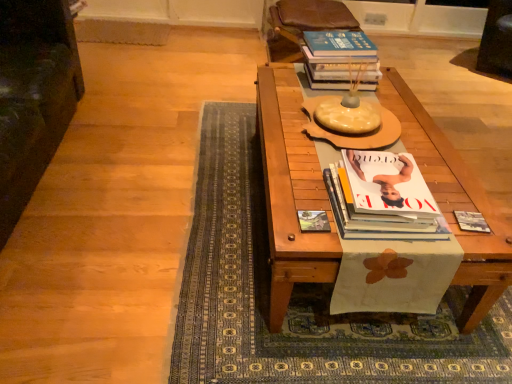
Measure the distance between matte black book at right, which is the 1th book in bottom-to-top order, and camera.

1.23 meters.

At what (x,y) coordinates should I click in order to perform the action: click on blue hardcover book at upper right, which is the third book from front to back. Please return your answer as a coordinate pair (x, y). This screenshot has width=512, height=384. Looking at the image, I should click on (340, 60).

What do you see at coordinates (340, 60) in the screenshot?
I see `blue hardcover book at upper right, placed as the 1th book when sorted from back to front` at bounding box center [340, 60].

The width and height of the screenshot is (512, 384). Identify the location of matte paper book cover at center. (313, 221).

What do you see at coordinates (313, 221) in the screenshot? The height and width of the screenshot is (384, 512). I see `matte paper book cover at center` at bounding box center [313, 221].

At what (x,y) coordinates should I click in order to perform the action: click on dark green fabric armchair at left, the 1th armchair in the left-to-right sequence. Please return your answer as a coordinate pair (x, y). The width and height of the screenshot is (512, 384). Looking at the image, I should click on (33, 96).

Find the location of a particular element. The height and width of the screenshot is (384, 512). book cover above the matte black book at right, the 2th book when ordered from back to front (from a real-world perspective) is located at coordinates (313, 221).

Is matte paper book cover at center to the left of matte black book at right, marked as the third book in a top-to-bottom arrangement, from the viewer's perspective?

Correct, you'll find matte paper book cover at center to the left of matte black book at right, marked as the third book in a top-to-bottom arrangement.

Can we say matte paper book cover at center lies outside matte black book at right, the 2th book when ordered from back to front?

That's correct, matte paper book cover at center is outside of matte black book at right, the 2th book when ordered from back to front.

Is matte paper book cover at center looking in the opposite direction of matte black book at right, the 2th book when ordered from back to front?

Correct, matte paper book cover at center is looking away from matte black book at right, the 2th book when ordered from back to front.

From a real-world perspective, does matte black book at right, which is the 2th book in front-to-back order, sit lower than brown leather armchair at upper center, the 2th armchair when ordered from left to right?

Actually, matte black book at right, which is the 2th book in front-to-back order, is physically above brown leather armchair at upper center, the 2th armchair when ordered from left to right, in the real world.

Considering the points (466, 227) and (264, 2), which point is in front, point (466, 227) or point (264, 2)?

The point (466, 227) is in front.

Considering the sizes of objects matte black book at right, which is the 2th book in front-to-back order, and brown leather armchair at upper center, which is the first armchair in back-to-front order, in the image provided, who is thinner, matte black book at right, which is the 2th book in front-to-back order, or brown leather armchair at upper center, which is the first armchair in back-to-front order,?

matte black book at right, which is the 2th book in front-to-back order.

From the image's perspective, is wooden table at center above or below brown leather armchair at upper center, the 2th armchair when ordered from left to right?

From the image's perspective, wooden table at center appears below brown leather armchair at upper center, the 2th armchair when ordered from left to right.

From the image's perspective, starting from the wooden table at center, which armchair is the 2nd one above? Please provide its 2D coordinates.

[(301, 25)]

Is wooden table at center far from brown leather armchair at upper center, the 2th armchair when ordered from left to right?

Indeed, wooden table at center is not near brown leather armchair at upper center, the 2th armchair when ordered from left to right.

Is wooden table at center inside or outside of brown leather armchair at upper center, which is counted as the 2th armchair, starting from the front?

wooden table at center cannot be found inside brown leather armchair at upper center, which is counted as the 2th armchair, starting from the front.

Is brown leather armchair at upper center, which is the first armchair in right-to-left order, bigger than white glossy magazine at center, acting as the 2th book starting from the top?

Yes, brown leather armchair at upper center, which is the first armchair in right-to-left order, is bigger than white glossy magazine at center, acting as the 2th book starting from the top.

Is brown leather armchair at upper center, which is the first armchair in right-to-left order, next to white glossy magazine at center, the third book from the back, and touching it?

There is a gap between brown leather armchair at upper center, which is the first armchair in right-to-left order, and white glossy magazine at center, the third book from the back.

From the image's perspective, which one is positioned lower, brown leather armchair at upper center, the 2th armchair when ordered from left to right, or white glossy magazine at center, acting as the 2th book starting from the top?

white glossy magazine at center, acting as the 2th book starting from the top, from the image's perspective.

From the brown leather armchair at upper center, which is counted as the 2th armchair, starting from the front, count the 1st book to the left and point to it. Please provide its 2D coordinates.

[(381, 198)]

Is blue hardcover book at upper right, the 1th book in the top-to-bottom sequence, located within matte black book at right, which is the 1th book in bottom-to-top order?

No, blue hardcover book at upper right, the 1th book in the top-to-bottom sequence, is located outside of matte black book at right, which is the 1th book in bottom-to-top order.

Between matte black book at right, the 2th book when ordered from back to front, and blue hardcover book at upper right, which is the third book from front to back, which one has more height?

blue hardcover book at upper right, which is the third book from front to back.

In the scene shown: In the image, is matte black book at right, which is the 2th book in front-to-back order, on the left side or the right side of blue hardcover book at upper right, placed as the 1th book when sorted from back to front?

Clearly, matte black book at right, which is the 2th book in front-to-back order, is on the right of blue hardcover book at upper right, placed as the 1th book when sorted from back to front, in the image.

From the picture: Does matte black book at right, which is the 2th book in front-to-back order, touch blue hardcover book at upper right, the 1th book in the top-to-bottom sequence?

No.

Considering the relative positions of wooden table at center and white glossy magazine at center, the first book in the front-to-back sequence, in the image provided, is wooden table at center to the right of white glossy magazine at center, the first book in the front-to-back sequence, from the viewer's perspective?

In fact, wooden table at center is to the left of white glossy magazine at center, the first book in the front-to-back sequence.

Measure the distance from wooden table at center to white glossy magazine at center, which is counted as the 2th book, starting from the bottom.

wooden table at center and white glossy magazine at center, which is counted as the 2th book, starting from the bottom, are 8.78 inches apart from each other.

Is wooden table at center inside the boundaries of white glossy magazine at center, which is counted as the 2th book, starting from the bottom, or outside?

wooden table at center exists outside the volume of white glossy magazine at center, which is counted as the 2th book, starting from the bottom.

Considering their positions, is wooden table at center located in front of or behind white glossy magazine at center, acting as the 2th book starting from the top?

Clearly, wooden table at center is in front of white glossy magazine at center, acting as the 2th book starting from the top.

From the picture: From a real-world perspective, is dark green fabric armchair at left, marked as the second armchair in a back-to-front arrangement, under blue hardcover book at upper right, placed as the 1th book when sorted from back to front?

Yes, from a real-world perspective, dark green fabric armchair at left, marked as the second armchair in a back-to-front arrangement, is beneath blue hardcover book at upper right, placed as the 1th book when sorted from back to front.

Considering the relative positions of dark green fabric armchair at left, the second armchair when ordered from right to left, and blue hardcover book at upper right, the 1th book in the top-to-bottom sequence, in the image provided, is dark green fabric armchair at left, the second armchair when ordered from right to left, to the right of blue hardcover book at upper right, the 1th book in the top-to-bottom sequence, from the viewer's perspective?

No, dark green fabric armchair at left, the second armchair when ordered from right to left, is not to the right of blue hardcover book at upper right, the 1th book in the top-to-bottom sequence.

Are dark green fabric armchair at left, the 1th armchair in the left-to-right sequence, and blue hardcover book at upper right, the third book ordered from the bottom, making contact?

There is a gap between dark green fabric armchair at left, the 1th armchair in the left-to-right sequence, and blue hardcover book at upper right, the third book ordered from the bottom.

Where is `book cover located above the matte black book at right, marked as the third book in a top-to-bottom arrangement (from the image's perspective)`? Image resolution: width=512 pixels, height=384 pixels. book cover located above the matte black book at right, marked as the third book in a top-to-bottom arrangement (from the image's perspective) is located at coordinates (313, 221).

This screenshot has width=512, height=384. What are the coordinates of `armchair that is behind the matte black book at right, marked as the third book in a top-to-bottom arrangement` in the screenshot? It's located at (301, 25).

Consider the image. Which object lies further to the anchor point matte black book at right, the 2th book when ordered from back to front, matte paper book cover at center or dark green fabric armchair at left, the second armchair when ordered from right to left?

dark green fabric armchair at left, the second armchair when ordered from right to left, lies further to matte black book at right, the 2th book when ordered from back to front, than the other object.

When comparing their distances from brown leather armchair at upper center, which is the first armchair in back-to-front order, does matte black book at right, which is the 1th book in bottom-to-top order, or white glossy magazine at center, which is counted as the 2th book, starting from the bottom, seem further?

Based on the image, matte black book at right, which is the 1th book in bottom-to-top order, appears to be further to brown leather armchair at upper center, which is the first armchair in back-to-front order.

When comparing their distances from matte black book at right, marked as the third book in a top-to-bottom arrangement, does brown leather armchair at upper center, the 2th armchair when ordered from left to right, or white glossy magazine at center, which is counted as the 2th book, starting from the bottom, seem closer?

white glossy magazine at center, which is counted as the 2th book, starting from the bottom, is closer to matte black book at right, marked as the third book in a top-to-bottom arrangement.

When comparing their distances from matte paper book cover at center, does white glossy magazine at center, which is counted as the 2th book, starting from the bottom, or wooden table at center seem closer?

The object closer to matte paper book cover at center is white glossy magazine at center, which is counted as the 2th book, starting from the bottom.

Looking at the image, which one is located closer to wooden table at center, blue hardcover book at upper right, which is the third book from front to back, or brown leather armchair at upper center, which is the first armchair in right-to-left order?

blue hardcover book at upper right, which is the third book from front to back, lies closer to wooden table at center than the other object.

Estimate the real-world distances between objects in this image. Which object is closer to brown leather armchair at upper center, which is counted as the 2th armchair, starting from the front, wooden table at center or dark green fabric armchair at left, placed as the first armchair when sorted from front to back?

The object closer to brown leather armchair at upper center, which is counted as the 2th armchair, starting from the front, is wooden table at center.

Considering their positions, is wooden table at center positioned further to matte paper book cover at center than dark green fabric armchair at left, marked as the second armchair in a back-to-front arrangement?

Based on the image, dark green fabric armchair at left, marked as the second armchair in a back-to-front arrangement, appears to be further to matte paper book cover at center.

From the image, which object appears to be nearer to white glossy magazine at center, the third book from the back, matte black book at right, which is the 1th book in bottom-to-top order, or wooden table at center?

wooden table at center is closer to white glossy magazine at center, the third book from the back.

Find the location of a particular element. table between matte paper book cover at center and white glossy magazine at center, acting as the 2th book starting from the top, from left to right is located at coordinates (291, 191).

Where is `book cover between dark green fabric armchair at left, the second armchair when ordered from right to left, and white glossy magazine at center, acting as the 2th book starting from the top, from left to right`? Image resolution: width=512 pixels, height=384 pixels. book cover between dark green fabric armchair at left, the second armchair when ordered from right to left, and white glossy magazine at center, acting as the 2th book starting from the top, from left to right is located at coordinates (313, 221).

Where is `table situated between matte paper book cover at center and matte black book at right, which is the 1th book in bottom-to-top order, from left to right`? The height and width of the screenshot is (384, 512). table situated between matte paper book cover at center and matte black book at right, which is the 1th book in bottom-to-top order, from left to right is located at coordinates [x=291, y=191].

This screenshot has height=384, width=512. Find the location of `book between dark green fabric armchair at left, the 1th armchair in the left-to-right sequence, and white glossy magazine at center, the first book in the front-to-back sequence, in the horizontal direction`. book between dark green fabric armchair at left, the 1th armchair in the left-to-right sequence, and white glossy magazine at center, the first book in the front-to-back sequence, in the horizontal direction is located at coordinates (340, 60).